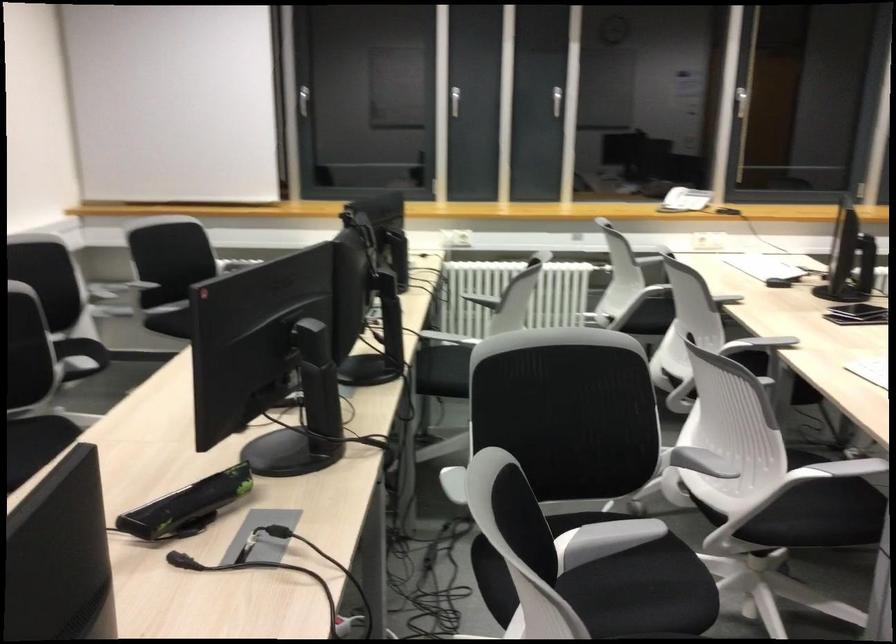
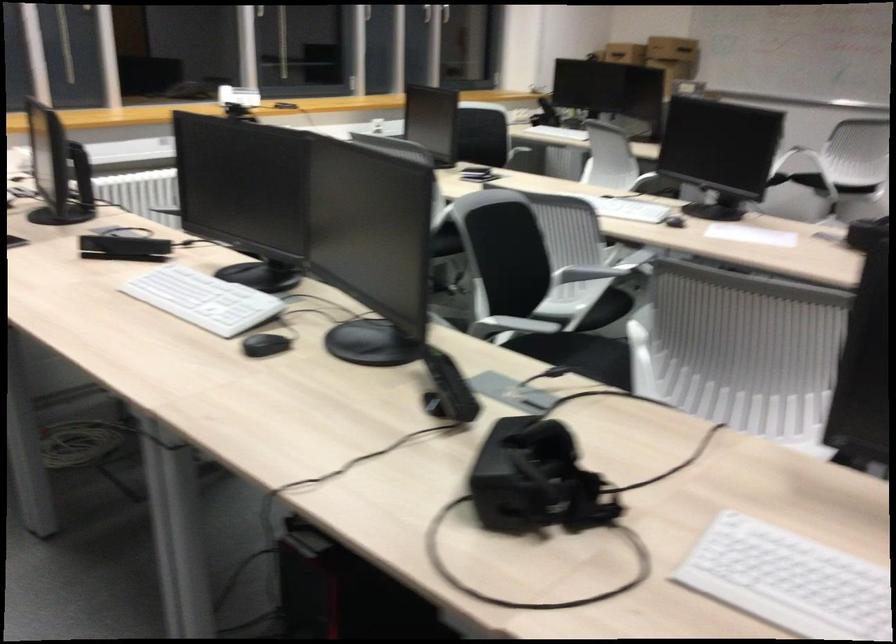
Locate, in the second image, the point that corresponds to point (618, 556) in the first image.

(579, 355)